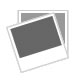
Find the location of a particular element. Image resolution: width=80 pixels, height=80 pixels. white space below pictures is located at coordinates (67, 63), (44, 70), (17, 69).